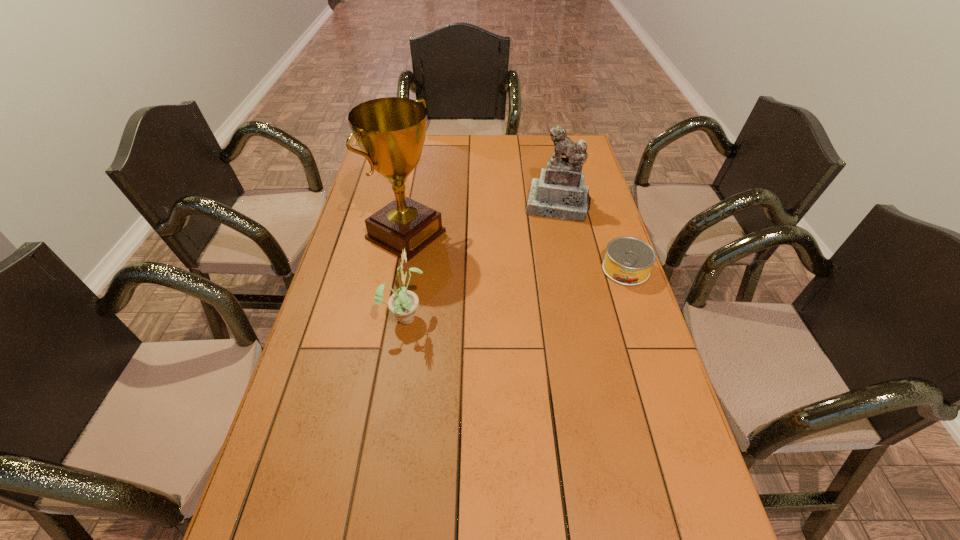
The height and width of the screenshot is (540, 960). I want to click on vacant region located on the front-facing side of the figurine, so click(551, 238).

In order to click on vacant region located 0.280m on the front-facing side of the figurine in this screenshot , I will do `click(543, 277)`.

This screenshot has height=540, width=960. What are the coordinates of `vacant area situated on the front-facing side of the figurine` in the screenshot? It's located at (538, 304).

Where is `object present at the left edge`? This screenshot has height=540, width=960. object present at the left edge is located at coordinates (390, 131).

This screenshot has height=540, width=960. Find the location of `can present at the right edge`. can present at the right edge is located at coordinates (628, 261).

Locate an element on the screen. This screenshot has height=540, width=960. figurine present at the right edge is located at coordinates (560, 193).

Find the location of `vacant region at the far edge of the desktop`. vacant region at the far edge of the desktop is located at coordinates (501, 140).

In the image, there is a desktop. Where is `vacant space at the near edge`? This screenshot has width=960, height=540. vacant space at the near edge is located at coordinates (433, 530).

This screenshot has height=540, width=960. Find the location of `vacant space at the left edge`. vacant space at the left edge is located at coordinates (383, 185).

In the image, there is a desktop. Identify the location of vacant space at the right edge. (593, 278).